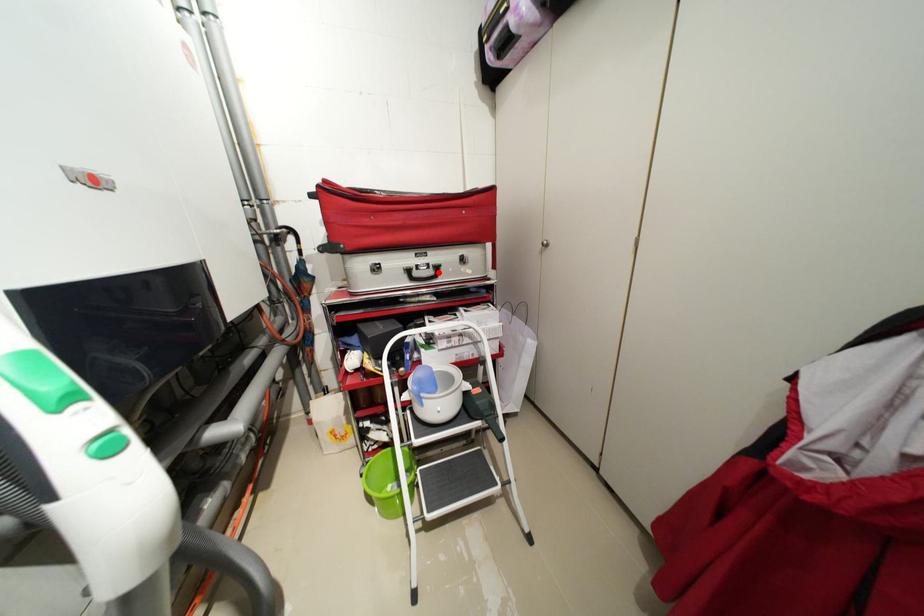
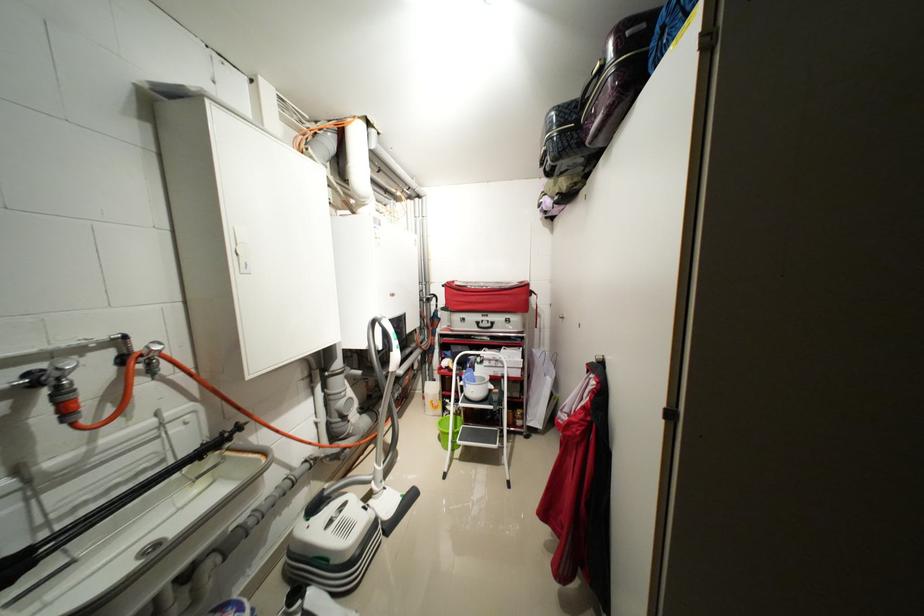
Find the pixel in the second image that matches the highlighted location in the first image.

(496, 326)